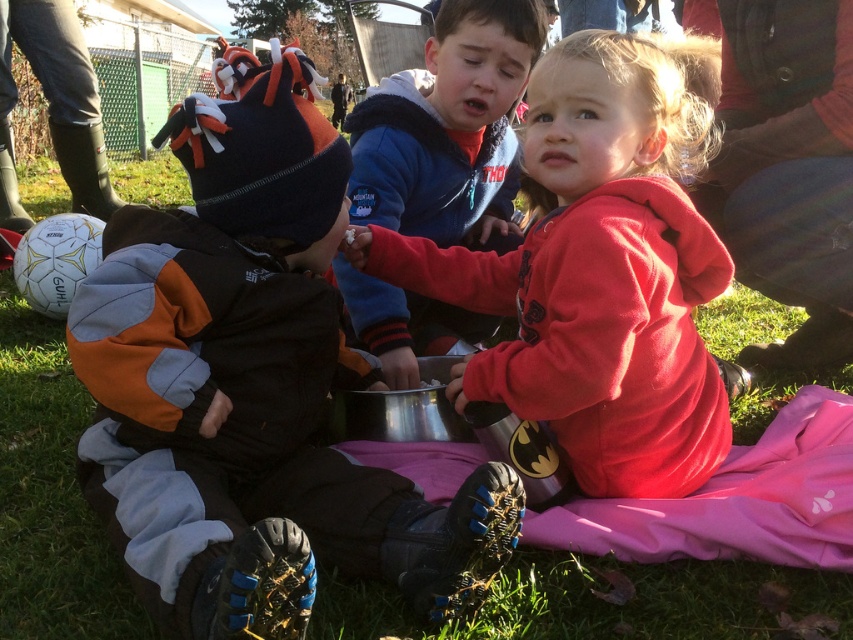
Describe the element at coordinates (253, 388) in the screenshot. The image size is (853, 640). I see `orange fleece jacket at center` at that location.

Who is more forward, (158, 305) or (672, 195)?

Point (158, 305) is in front.

Where is `orange fleece jacket at center`? orange fleece jacket at center is located at coordinates (253, 388).

Which is in front, point (241, 131) or point (466, 179)?

Point (241, 131) is more forward.

Measure the distance between point (79, 316) and camera.

They are 1.33 meters apart.

The width and height of the screenshot is (853, 640). What are the coordinates of `orange fleece jacket at center` in the screenshot? It's located at (253, 388).

Who is taller, red fleece jacket at center or blue fleece jacket at center?

Standing taller between the two is blue fleece jacket at center.

Can you confirm if red fleece jacket at center is positioned below blue fleece jacket at center?

Indeed, red fleece jacket at center is positioned under blue fleece jacket at center.

Who is more forward, (577, 256) or (544, 20)?

Point (577, 256) is in front.

Image resolution: width=853 pixels, height=640 pixels. I want to click on red fleece jacket at center, so click(599, 268).